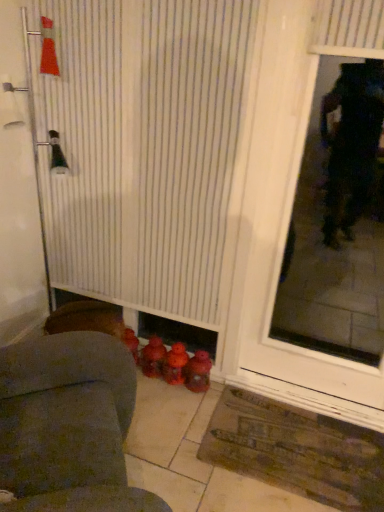
This screenshot has height=512, width=384. Describe the element at coordinates (296, 451) in the screenshot. I see `brown textured mat at lower right` at that location.

Locate an element on the screen. Image resolution: width=384 pixels, height=512 pixels. transparent glass door at right is located at coordinates (338, 220).

Identify the location of velvet gray armchair at lower left. The height and width of the screenshot is (512, 384). (68, 425).

At what (x,y) coordinates should I click in order to perform the action: click on rubberized plastic toy at center, the 1th toy when ordered from left to right. Please return your answer as a coordinate pair (x, y). Image resolution: width=384 pixels, height=512 pixels. Looking at the image, I should click on (152, 357).

Identify the location of white striped shower curtain at lower center. The image size is (384, 512). pos(146,149).

What do you see at coordinates (18, 192) in the screenshot? I see `white textured door at left` at bounding box center [18, 192].

The width and height of the screenshot is (384, 512). In order to click on brown textured mat at lower right in this screenshot , I will do `click(296, 451)`.

Is rubberized plastic toy at center, which is the 3th toy in right-to-left order, oriented away from transparent glass door at right?

That's not correct — rubberized plastic toy at center, which is the 3th toy in right-to-left order, is not looking away from transparent glass door at right.

From the picture: From a real-world perspective, does rubberized plastic toy at center, which is the 3th toy in right-to-left order, stand above transparent glass door at right?

No.

Which is behind, rubberized plastic toy at center, which is the 3th toy in right-to-left order, or transparent glass door at right?

Positioned behind is rubberized plastic toy at center, which is the 3th toy in right-to-left order.

Can you see rubberized plastic toy at center, the 1th toy when ordered from left to right, touching transparent glass door at right?

rubberized plastic toy at center, the 1th toy when ordered from left to right, is not next to transparent glass door at right, and they're not touching.

Which of these two, rubberized plastic toy at lower center, arranged as the 2th toy when viewed from the right, or transparent glass door at right, stands shorter?

rubberized plastic toy at lower center, arranged as the 2th toy when viewed from the right, is shorter.

Is rubberized plastic toy at lower center, arranged as the 2th toy when viewed from the right, wider or thinner than transparent glass door at right?

Clearly, rubberized plastic toy at lower center, arranged as the 2th toy when viewed from the right, has more width compared to transparent glass door at right.

Is rubberized plastic toy at lower center, the 2th toy when ordered from left to right, oriented away from transparent glass door at right?

rubberized plastic toy at lower center, the 2th toy when ordered from left to right, is not turned away from transparent glass door at right.

Considering the relative positions of rubberized plastic toy at lower center, arranged as the 2th toy when viewed from the right, and transparent glass door at right in the image provided, is rubberized plastic toy at lower center, arranged as the 2th toy when viewed from the right, to the left of transparent glass door at right from the viewer's perspective?

Indeed, rubberized plastic toy at lower center, arranged as the 2th toy when viewed from the right, is positioned on the left side of transparent glass door at right.

Is velvet gray armchair at lower left oriented towards rubberized plastic toy at lower center, arranged as the 2th toy when viewed from the right?

No, velvet gray armchair at lower left is not aimed at rubberized plastic toy at lower center, arranged as the 2th toy when viewed from the right.

Is point (117, 483) behind point (163, 362)?

No, it is in front of (163, 362).

Considering the positions of objects velvet gray armchair at lower left and rubberized plastic toy at lower center, arranged as the 2th toy when viewed from the right, in the image provided, who is in front, velvet gray armchair at lower left or rubberized plastic toy at lower center, arranged as the 2th toy when viewed from the right,?

velvet gray armchair at lower left is in front.

Between velvet gray armchair at lower left and rubberized plastic toy at lower center, arranged as the 2th toy when viewed from the right, which one has less height?

With less height is rubberized plastic toy at lower center, arranged as the 2th toy when viewed from the right.

Would you say rubberized red toy at lower center, which appears as the 3th toy when viewed from the left, contains white textured door at left?

No, white textured door at left is not a part of rubberized red toy at lower center, which appears as the 3th toy when viewed from the left.

Is rubberized red toy at lower center, which appears as the 3th toy when viewed from the left, bigger than white textured door at left?

Incorrect, rubberized red toy at lower center, which appears as the 3th toy when viewed from the left, is not larger than white textured door at left.

Does point (205, 353) come closer to viewer compared to point (5, 241)?

No.

From the image's perspective, would you say rubberized red toy at lower center, the first toy positioned from the right, is positioned over white textured door at left?

No, from the image's perspective, rubberized red toy at lower center, the first toy positioned from the right, is not over white textured door at left.

In the scene shown: How far apart are rubberized plastic toy at lower center, arranged as the 2th toy when viewed from the right, and rubberized red toy at lower center, the first toy positioned from the right?

They are 2.52 inches apart.

Does rubberized plastic toy at lower center, arranged as the 2th toy when viewed from the right, touch rubberized red toy at lower center, which appears as the 3th toy when viewed from the left?

Yes, rubberized plastic toy at lower center, arranged as the 2th toy when viewed from the right, is touching rubberized red toy at lower center, which appears as the 3th toy when viewed from the left.

Can you tell me how much rubberized plastic toy at lower center, the 2th toy when ordered from left to right, and rubberized red toy at lower center, the first toy positioned from the right, differ in facing direction?

rubberized plastic toy at lower center, the 2th toy when ordered from left to right, and rubberized red toy at lower center, the first toy positioned from the right, are facing 0 degrees away from each other.

Is rubberized plastic toy at lower center, the 2th toy when ordered from left to right, taller than rubberized red toy at lower center, which appears as the 3th toy when viewed from the left?

Yes.

Does transparent glass door at right have a greater height compared to rubberized red toy at lower center, the first toy positioned from the right?

Correct, transparent glass door at right is much taller as rubberized red toy at lower center, the first toy positioned from the right.

Between transparent glass door at right and rubberized red toy at lower center, which appears as the 3th toy when viewed from the left, which one is positioned in front?

transparent glass door at right is closer to the camera.

Considering the sizes of objects transparent glass door at right and rubberized red toy at lower center, the first toy positioned from the right, in the image provided, who is thinner, transparent glass door at right or rubberized red toy at lower center, the first toy positioned from the right,?

Thinner between the two is transparent glass door at right.

From the image's perspective, would you say transparent glass door at right is positioned over rubberized red toy at lower center, which appears as the 3th toy when viewed from the left?

Yes, from the image's perspective, transparent glass door at right is above rubberized red toy at lower center, which appears as the 3th toy when viewed from the left.

Is rubberized plastic toy at lower center, arranged as the 2th toy when viewed from the right, looking in the opposite direction of brown textured mat at lower right?

rubberized plastic toy at lower center, arranged as the 2th toy when viewed from the right, is not turned away from brown textured mat at lower right.

Is the surface of rubberized plastic toy at lower center, arranged as the 2th toy when viewed from the right, in direct contact with brown textured mat at lower right?

No, rubberized plastic toy at lower center, arranged as the 2th toy when viewed from the right, is not touching brown textured mat at lower right.

Does rubberized plastic toy at lower center, arranged as the 2th toy when viewed from the right, have a lesser height compared to brown textured mat at lower right?

Incorrect, the height of rubberized plastic toy at lower center, arranged as the 2th toy when viewed from the right, does not fall short of that of brown textured mat at lower right.

In the image, there is a rubberized plastic toy at center, the 1th toy when ordered from left to right. Identify the location of window screen above it (from the image's perspective). (338, 220).

Find the location of `the 2nd toy to the left when counting from the transparent glass door at right`. the 2nd toy to the left when counting from the transparent glass door at right is located at coordinates click(175, 364).

From the image, which object appears to be nearer to rubberized plastic toy at center, which is the 3th toy in right-to-left order, velvet gray armchair at lower left or transparent glass door at right?

The object closer to rubberized plastic toy at center, which is the 3th toy in right-to-left order, is velvet gray armchair at lower left.

Looking at the image, which one is located closer to rubberized plastic toy at center, which is the 3th toy in right-to-left order, white textured door at left or rubberized red toy at lower center, which appears as the 3th toy when viewed from the left?

rubberized red toy at lower center, which appears as the 3th toy when viewed from the left, is closer to rubberized plastic toy at center, which is the 3th toy in right-to-left order.

From the image, which object appears to be nearer to rubberized plastic toy at center, which is the 3th toy in right-to-left order, velvet gray armchair at lower left or brown textured mat at lower right?

brown textured mat at lower right lies closer to rubberized plastic toy at center, which is the 3th toy in right-to-left order, than the other object.

When comparing their distances from white striped shower curtain at lower center, does rubberized plastic toy at center, the 1th toy when ordered from left to right, or rubberized red toy at lower center, which appears as the 3th toy when viewed from the left, seem further?

rubberized red toy at lower center, which appears as the 3th toy when viewed from the left, is further to white striped shower curtain at lower center.

Looking at the image, which one is located further to rubberized plastic toy at center, the 1th toy when ordered from left to right, white textured door at left or transparent glass door at right?

transparent glass door at right.

Which object lies nearer to the anchor point brown textured mat at lower right, rubberized plastic toy at center, the 1th toy when ordered from left to right, or white striped shower curtain at lower center?

rubberized plastic toy at center, the 1th toy when ordered from left to right, is closer to brown textured mat at lower right.

Consider the image. When comparing their distances from rubberized red toy at lower center, the first toy positioned from the right, does brown textured mat at lower right or rubberized plastic toy at lower center, the 2th toy when ordered from left to right, seem closer?

Based on the image, rubberized plastic toy at lower center, the 2th toy when ordered from left to right, appears to be nearer to rubberized red toy at lower center, the first toy positioned from the right.

When comparing their distances from rubberized plastic toy at center, the 1th toy when ordered from left to right, does white striped shower curtain at lower center or rubberized plastic toy at lower center, the 2th toy when ordered from left to right, seem further?

The object further to rubberized plastic toy at center, the 1th toy when ordered from left to right, is white striped shower curtain at lower center.

This screenshot has width=384, height=512. I want to click on shower curtain that lies between white textured door at left and rubberized plastic toy at lower center, arranged as the 2th toy when viewed from the right, from top to bottom, so click(146, 149).

The width and height of the screenshot is (384, 512). I want to click on shower curtain between white textured door at left and rubberized plastic toy at center, which is the 3th toy in right-to-left order, in the up-down direction, so click(x=146, y=149).

This screenshot has height=512, width=384. In order to click on window screen between white striped shower curtain at lower center and brown textured mat at lower right in the vertical direction in this screenshot , I will do `click(338, 220)`.

Identify the location of shower curtain between white textured door at left and velvet gray armchair at lower left in the up-down direction. [146, 149].